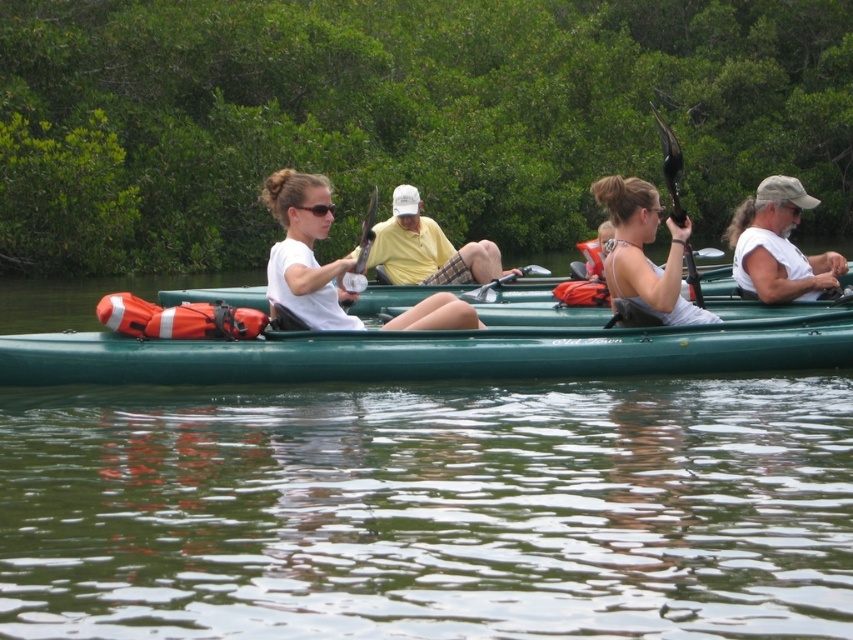
You are a safety inspector checking the safety of the kayaks in the image. According to safety regulations, the paddle must be within 2 meters of the kayak to ensure quick access. Is the wooden paddle at center meeting this requirement for the white matte kayak at center?

The distance between the white matte kayak at center and the wooden paddle at center is 2.27 meters, which exceeds the 2 meter requirement. Therefore, the wooden paddle at center is not within the required distance for the white matte kayak at center.